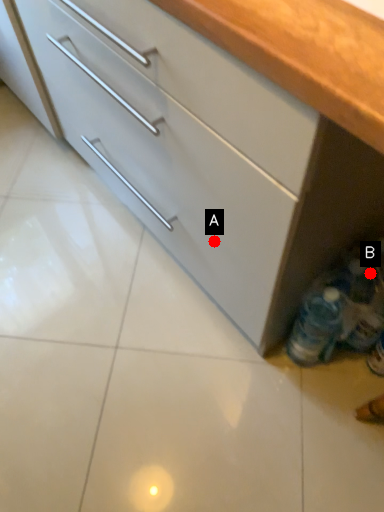
Question: Two points are circled on the image, labeled by A and B beside each circle. Which point appears closest to the camera in this image?

Choices:
 (A) A is closer
 (B) B is closer

Answer: (A)